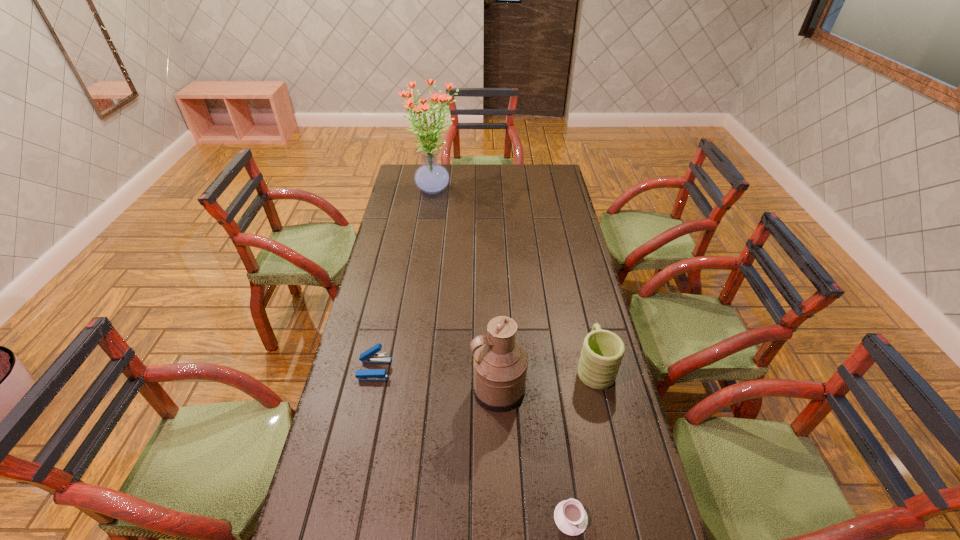
You are a GUI agent. You are given a task and a screenshot of the screen. Output one action in this format:
    pyautogui.click(x=<x>, y=<y>)
    Task: Click on the stapler located in the left edge section of the desktop
    This screenshot has height=540, width=960.
    Given the screenshot: What is the action you would take?
    pyautogui.click(x=369, y=356)

The height and width of the screenshot is (540, 960). What are the coordinates of `mug at the right edge` in the screenshot? It's located at (602, 352).

Where is `teacup positioned at the right edge`? teacup positioned at the right edge is located at coordinates coord(570,517).

I want to click on object located in the far left corner section of the desktop, so click(431, 177).

Identify the location of free space at the far edge of the desktop. The width and height of the screenshot is (960, 540). (500, 186).

Find the location of a particular element. vacant space at the left edge of the desktop is located at coordinates (348, 452).

Where is `vacant space at the right edge of the desktop`? vacant space at the right edge of the desktop is located at coordinates (610, 527).

Where is `free spot at the far right corner of the desktop`? This screenshot has height=540, width=960. free spot at the far right corner of the desktop is located at coordinates (546, 177).

The height and width of the screenshot is (540, 960). I want to click on blank region between the third object from left to right and the shortest object, so click(535, 454).

The height and width of the screenshot is (540, 960). I want to click on free spot between the second shortest object and the flower arrangement, so click(x=404, y=279).